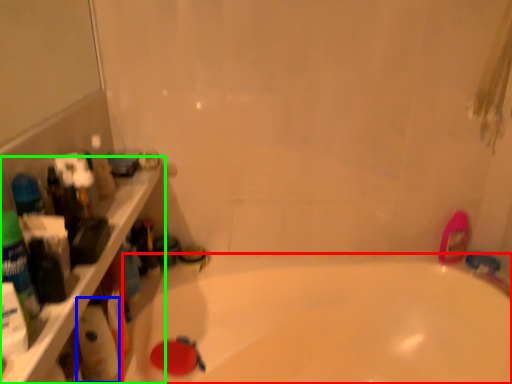
Question: Based on their relative distances, which object is nearer to bathtub (highlighted by a red box)? Choose from cleaning product (highlighted by a blue box) and ledge (highlighted by a green box).

Choices:
 (A) cleaning product
 (B) ledge

Answer: (A)